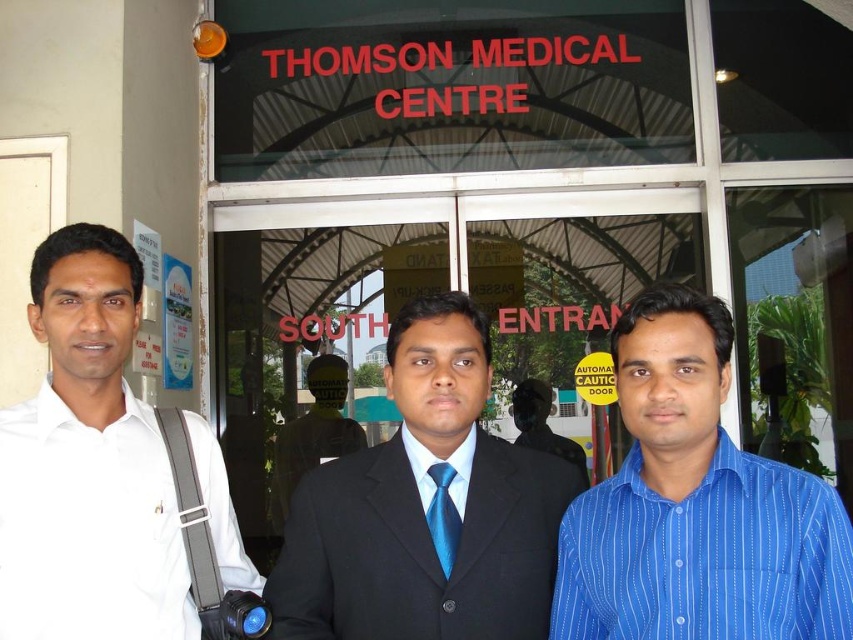
Question: Which object is farther from the camera taking this photo?

Choices:
 (A) blue silk suit at center
 (B) black suit at center

Answer: (A)

Question: Which object is positioned closest to the blue striped shirt at right?

Choices:
 (A) blue tie at center
 (B) white shirt at left
 (C) blue silk suit at center
 (D) black suit at center

Answer: (D)

Question: Which point is closer to the camera?

Choices:
 (A) blue satin tie at center
 (B) blue striped shirt at right
 (C) blue silk suit at center

Answer: (B)

Question: Considering the relative positions of blue striped shirt at right and blue satin tie at center in the image provided, where is blue striped shirt at right located with respect to blue satin tie at center?

Choices:
 (A) left
 (B) right

Answer: (B)

Question: Does blue striped shirt at right appear on the left side of black suit at center?

Choices:
 (A) yes
 (B) no

Answer: (B)

Question: In this image, where is black suit at center located relative to white shirt at left?

Choices:
 (A) left
 (B) right

Answer: (B)